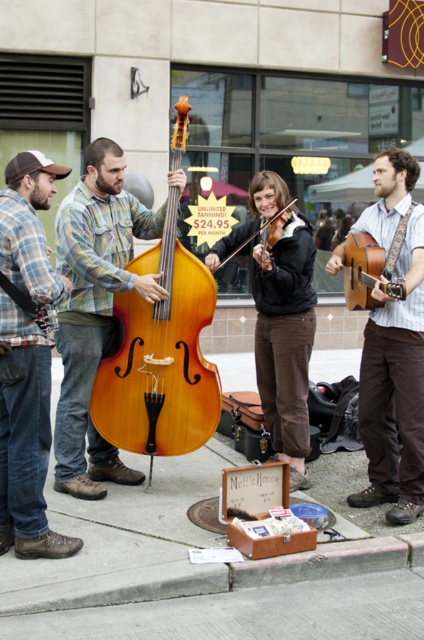
You are standing in front of the street performers and want to place a 2.5 meter long banner between yourself and the wooden suitcase at center. Is there enough space to do so without the banner overlapping the performers?

The distance between you and the wooden suitcase at center is 3.27 meters. Since the banner is only 2.5 meters long, there is enough space to place it without overlapping the performers.

You are standing at the point labeled point (206, 570) in the image. Which object is directly in front of you?

The wooden suitcase at center is directly in front of you at point (206, 570).

You are a photographer trying to capture the crowd in front of the musicians. You notice two shirts at the center of your viewfinder. Which shirt is visible on top between the matte plaid shirt at center and the striped cotton shirt at center?

The matte plaid shirt at center is visible on top of the striped cotton shirt at center because it is located above it.